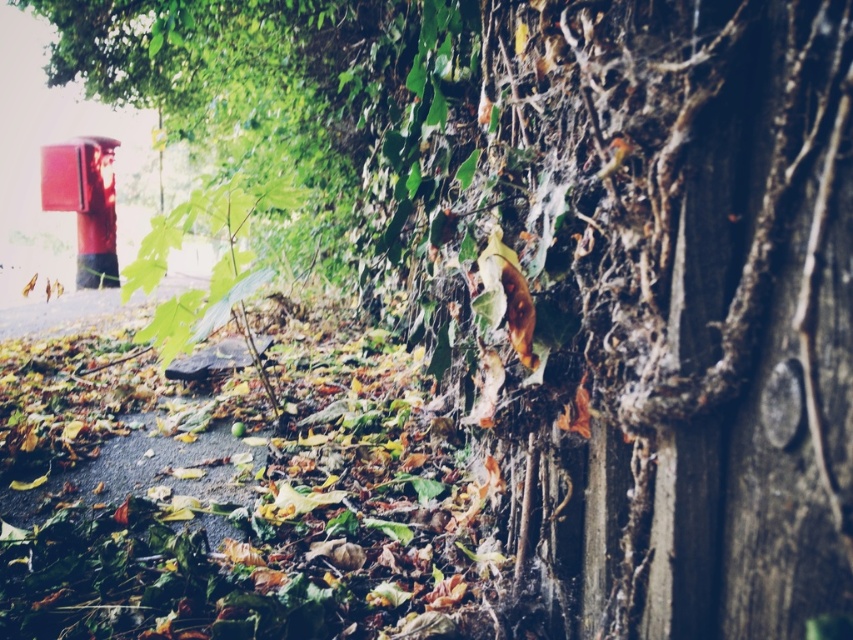
Which is in front, point (746, 378) or point (96, 173)?

Positioned in front is point (746, 378).

Is the position of dark brown wood at center less distant than that of metallic red fire hydrant at upper left?

Yes.

Who is more forward, (575, 124) or (111, 179)?

Positioned in front is point (575, 124).

Where is `dark brown wood at center`? This screenshot has height=640, width=853. dark brown wood at center is located at coordinates (695, 301).